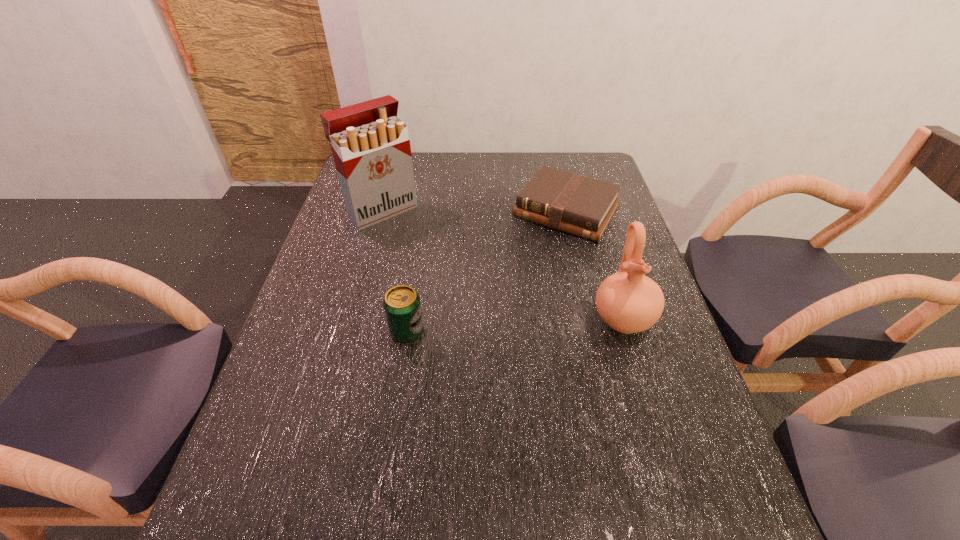
Image resolution: width=960 pixels, height=540 pixels. I want to click on free spot located 0.400m on the spine side of the shortest object, so [482, 332].

Where is `vacant space positioned on the spine side of the shortest object`? This screenshot has height=540, width=960. vacant space positioned on the spine side of the shortest object is located at coordinates (486, 326).

Identify the location of object that is at the far edge. The height and width of the screenshot is (540, 960). (576, 204).

You are a GUI agent. You are given a task and a screenshot of the screen. Output one action in this format:
    pyautogui.click(x=<x>, y=<y>)
    Task: Click on the object positioned at the left edge
    The height and width of the screenshot is (540, 960).
    Given the screenshot: What is the action you would take?
    pyautogui.click(x=371, y=148)

The width and height of the screenshot is (960, 540). I want to click on pottery present at the right edge, so click(x=630, y=302).

Locate an element on the screen. The height and width of the screenshot is (540, 960). Bible positioned at the right edge is located at coordinates (576, 204).

Where is `object that is positioned at the far right corner`? This screenshot has width=960, height=540. object that is positioned at the far right corner is located at coordinates (576, 204).

Locate an element on the screen. The height and width of the screenshot is (540, 960). vacant space at the far edge is located at coordinates (419, 172).

This screenshot has height=540, width=960. I want to click on free space at the left edge of the desktop, so click(331, 251).

Identify the location of free space at the right edge of the desktop. (638, 339).